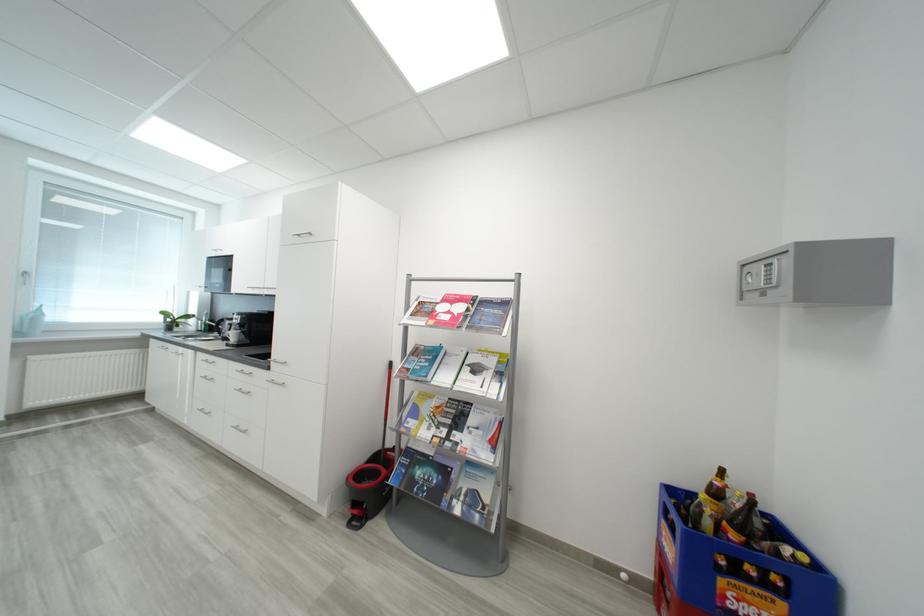
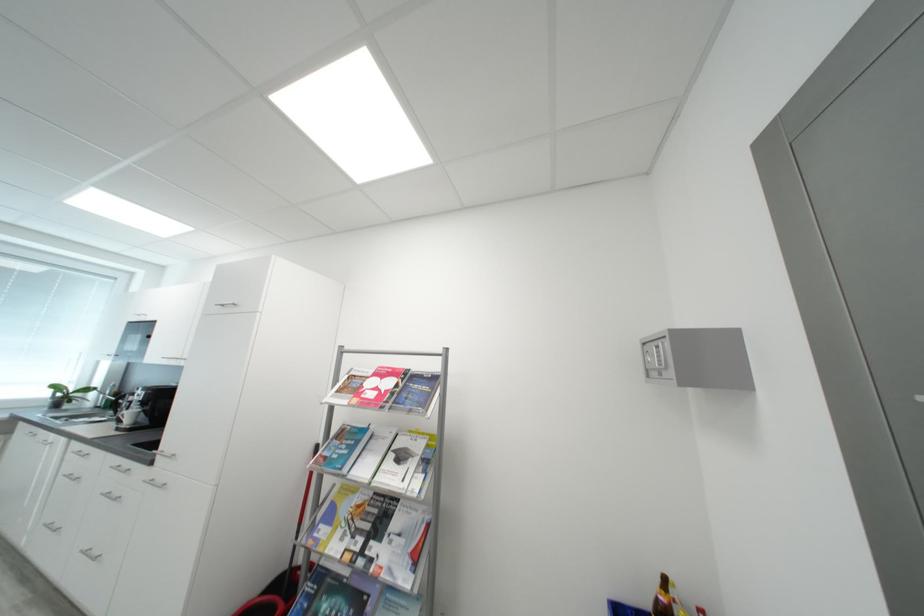
Find the pixel in the second image that matches [209,411] in the first image.

(56, 527)